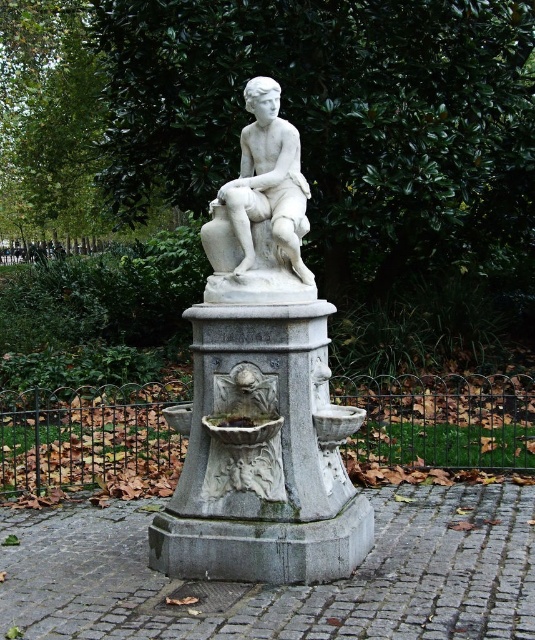
You are a landscape architect designing a new garden layout. You need to place a new bench that requires at least 2 meters of space around it. Given the gray stone fountain at center and the white marble statue at center, which object would you consider moving to accommodate the bench?

The gray stone fountain at center is bigger than the white marble statue at center, so moving the smaller white marble statue at center would be more feasible to create space for the bench.

You are standing in a park and see the iron wire fence at center. If you walk straight ahead, will you eventually reach the fountain?

The iron wire fence at center is located at point (90, 440), so walking straight ahead might not necessarily lead you to the fountain unless the path is aligned that way. The description does not provide information about the direction of the path relative to the fountain.